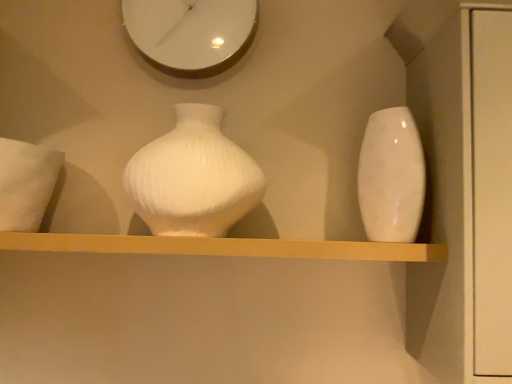
Locate an element on the screen. The height and width of the screenshot is (384, 512). white glossy clock at upper center is located at coordinates (191, 33).

Describe the element at coordinates (26, 183) in the screenshot. Image resolution: width=512 pixels, height=384 pixels. I see `white soft pillow at left` at that location.

In order to face glossy ceramic vase at right, arranged as the 2th vase when viewed from the left, should I rotate leftwards or rightwards?

Turn right by 17.875 degrees to look at glossy ceramic vase at right, arranged as the 2th vase when viewed from the left.

Locate an element on the screen. matte white shelf at center is located at coordinates (224, 247).

Which object is positioned more to the right, white glossy clock at upper center or white ribbed vase at center, which is the 1th vase in left-to-right order?

white ribbed vase at center, which is the 1th vase in left-to-right order, is more to the right.

Can you confirm if white glossy clock at upper center is bigger than white ribbed vase at center, placed as the second vase when sorted from right to left?

No, white glossy clock at upper center is not bigger than white ribbed vase at center, placed as the second vase when sorted from right to left.

From the image's perspective, is white glossy clock at upper center over white ribbed vase at center, which is the 1th vase in left-to-right order?

Yes.

Can you confirm if white glossy clock at upper center is thinner than white ribbed vase at center, placed as the second vase when sorted from right to left?

Correct, the width of white glossy clock at upper center is less than that of white ribbed vase at center, placed as the second vase when sorted from right to left.

Is white glossy clock at upper center facing away from glossy ceramic vase at right, arranged as the 2th vase when viewed from the left?

No, white glossy clock at upper center is not facing the opposite direction of glossy ceramic vase at right, arranged as the 2th vase when viewed from the left.

Would you say white glossy clock at upper center is inside or outside glossy ceramic vase at right, arranged as the 2th vase when viewed from the left?

white glossy clock at upper center is located beyond the bounds of glossy ceramic vase at right, arranged as the 2th vase when viewed from the left.

Considering the relative positions of white glossy clock at upper center and glossy ceramic vase at right, arranged as the 2th vase when viewed from the left, in the image provided, is white glossy clock at upper center to the right of glossy ceramic vase at right, arranged as the 2th vase when viewed from the left, from the viewer's perspective?

No, white glossy clock at upper center is not to the right of glossy ceramic vase at right, arranged as the 2th vase when viewed from the left.

Is white glossy clock at upper center far from glossy ceramic vase at right, arranged as the 2th vase when viewed from the left?

They are positioned close to each other.

Is white ribbed vase at center, which is the 1th vase in left-to-right order, at the right side of white soft pillow at left?

Yes, white ribbed vase at center, which is the 1th vase in left-to-right order, is to the right of white soft pillow at left.

Considering the sizes of objects white ribbed vase at center, which is the 1th vase in left-to-right order, and white soft pillow at left in the image provided, who is taller, white ribbed vase at center, which is the 1th vase in left-to-right order, or white soft pillow at left?

With more height is white ribbed vase at center, which is the 1th vase in left-to-right order.

Where is `pillow located underneath the white ribbed vase at center, which is the 1th vase in left-to-right order (from a real-world perspective)`? pillow located underneath the white ribbed vase at center, which is the 1th vase in left-to-right order (from a real-world perspective) is located at coordinates (26, 183).

Who is smaller, glossy ceramic vase at right, arranged as the 2th vase when viewed from the left, or matte white shelf at center?

glossy ceramic vase at right, arranged as the 2th vase when viewed from the left, is smaller.

Consider the image. Is glossy ceramic vase at right, arranged as the 2th vase when viewed from the left, positioned before matte white shelf at center?

No, it is not.

Is matte white shelf at center thinner than glossy ceramic vase at right, placed as the first vase when sorted from right to left?

No, matte white shelf at center is not thinner than glossy ceramic vase at right, placed as the first vase when sorted from right to left.

Which vase is the 1st one when counting from the back of the matte white shelf at center? Please provide its 2D coordinates.

[(391, 177)]

Which is behind, point (430, 247) or point (369, 196)?

The point (369, 196) is more distant.

Which of these two, matte white shelf at center or glossy ceramic vase at right, arranged as the 2th vase when viewed from the left, stands taller?

glossy ceramic vase at right, arranged as the 2th vase when viewed from the left, is taller.

Considering the sizes of objects white soft pillow at left and matte white shelf at center in the image provided, who is thinner, white soft pillow at left or matte white shelf at center?

matte white shelf at center is thinner.

Is white soft pillow at left facing towards matte white shelf at center?

No, white soft pillow at left is not turned towards matte white shelf at center.

Is the position of white soft pillow at left less distant than that of matte white shelf at center?

Yes, the depth of white soft pillow at left is less than that of matte white shelf at center.

Which point is more distant from viewer, (216, 116) or (395, 141)?

The point (216, 116) is farther.

Is white ribbed vase at center, placed as the second vase when sorted from right to left, oriented away from glossy ceramic vase at right, placed as the first vase when sorted from right to left?

No, glossy ceramic vase at right, placed as the first vase when sorted from right to left, is not at the back of white ribbed vase at center, placed as the second vase when sorted from right to left.

Is white ribbed vase at center, placed as the second vase when sorted from right to left, spatially inside glossy ceramic vase at right, arranged as the 2th vase when viewed from the left, or outside of it?

white ribbed vase at center, placed as the second vase when sorted from right to left, is not enclosed by glossy ceramic vase at right, arranged as the 2th vase when viewed from the left.

Is white ribbed vase at center, which is the 1th vase in left-to-right order, positioned in front of glossy ceramic vase at right, arranged as the 2th vase when viewed from the left?

That is False.

The image size is (512, 384). In order to click on clock above the white ribbed vase at center, placed as the second vase when sorted from right to left (from the image's perspective) in this screenshot , I will do `click(191, 33)`.

This screenshot has height=384, width=512. I want to click on clock located above the glossy ceramic vase at right, placed as the first vase when sorted from right to left (from a real-world perspective), so point(191,33).

Estimate the real-world distances between objects in this image. Which object is further from white glossy clock at upper center, white soft pillow at left or white ribbed vase at center, which is the 1th vase in left-to-right order?

white soft pillow at left is positioned further to the anchor white glossy clock at upper center.

When comparing their distances from white ribbed vase at center, which is the 1th vase in left-to-right order, does white glossy clock at upper center or matte white shelf at center seem closer?

Among the two, matte white shelf at center is located nearer to white ribbed vase at center, which is the 1th vase in left-to-right order.

When comparing their distances from glossy ceramic vase at right, placed as the first vase when sorted from right to left, does white soft pillow at left or white ribbed vase at center, placed as the second vase when sorted from right to left, seem closer?

white ribbed vase at center, placed as the second vase when sorted from right to left, is positioned closer to the anchor glossy ceramic vase at right, placed as the first vase when sorted from right to left.

Looking at the image, which one is located closer to white soft pillow at left, white glossy clock at upper center or glossy ceramic vase at right, placed as the first vase when sorted from right to left?

white glossy clock at upper center lies closer to white soft pillow at left than the other object.

From the picture: Looking at the image, which one is located further to white soft pillow at left, white ribbed vase at center, which is the 1th vase in left-to-right order, or matte white shelf at center?

white ribbed vase at center, which is the 1th vase in left-to-right order, is positioned further to the anchor white soft pillow at left.

Estimate the real-world distances between objects in this image. Which object is closer to white soft pillow at left, matte white shelf at center or white glossy clock at upper center?

matte white shelf at center is positioned closer to the anchor white soft pillow at left.

Estimate the real-world distances between objects in this image. Which object is closer to white soft pillow at left, matte white shelf at center or white ribbed vase at center, which is the 1th vase in left-to-right order?

matte white shelf at center lies closer to white soft pillow at left than the other object.

Based on their spatial positions, is white glossy clock at upper center or white soft pillow at left further from matte white shelf at center?

white glossy clock at upper center is further to matte white shelf at center.

You are a GUI agent. You are given a task and a screenshot of the screen. Output one action in this format:
    pyautogui.click(x=<x>, y=<y>)
    Task: Click on the vase situated between white soft pillow at left and matte white shelf at center from left to right
    
    Given the screenshot: What is the action you would take?
    pyautogui.click(x=193, y=177)

Image resolution: width=512 pixels, height=384 pixels. In order to click on pillow that lies between white glossy clock at upper center and matte white shelf at center from top to bottom in this screenshot , I will do `click(26, 183)`.

Identify the location of vase between white glossy clock at upper center and glossy ceramic vase at right, arranged as the 2th vase when viewed from the left. The image size is (512, 384). (193, 177).

Locate an element on the screen. clock located between white soft pillow at left and white ribbed vase at center, which is the 1th vase in left-to-right order, in the left-right direction is located at coordinates (191, 33).